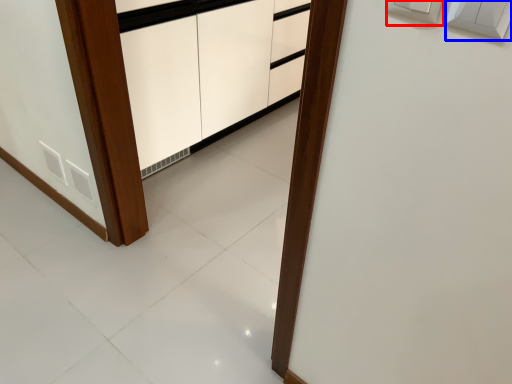
Question: Which object appears farthest to the camera in this image, electric outlet (highlighted by a red box) or light switch (highlighted by a blue box)?

Choices:
 (A) electric outlet
 (B) light switch

Answer: (A)